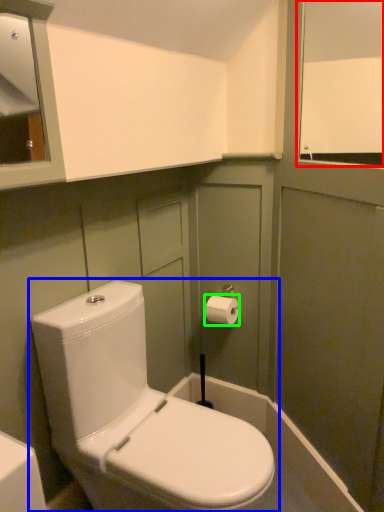
Question: Which object is positioned closest to window screen (highlighted by a red box)? Select from toilet (highlighted by a blue box) and toiletry (highlighted by a green box).

Choices:
 (A) toilet
 (B) toiletry

Answer: (B)